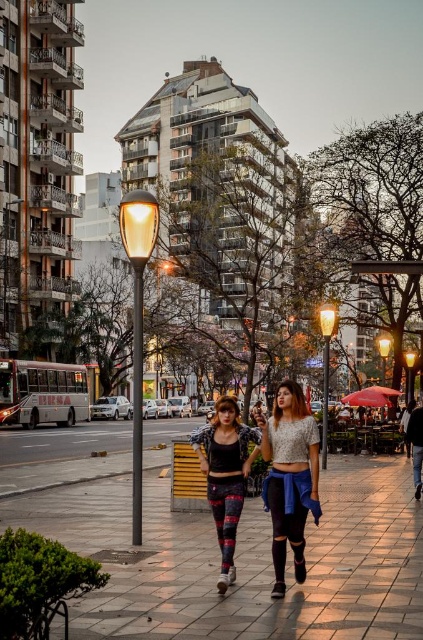
You are a city planner analyzing the street layout. Given the presence of both the matte yellow glass at center and the metallic streetlight at center, which object would cast a longer shadow during the late afternoon sun? Please base your answer on their relative heights as depicted in the image.

The matte yellow glass at center is taller than the metallic streetlight at center, so it would cast a longer shadow during the late afternoon sun.

In the scene, where is the matte lace top at center located in terms of its 2D coordinates?

The matte lace top at center is located at the 2D coordinates point [290,477].

You are standing on the polished stone pavement at center and want to hand a document to the person wearing the matte lace top at center. Can you reach them without moving from your current position?

The polished stone pavement at center is closer to the viewer than matte lace top at center, so you cannot reach them without moving closer.